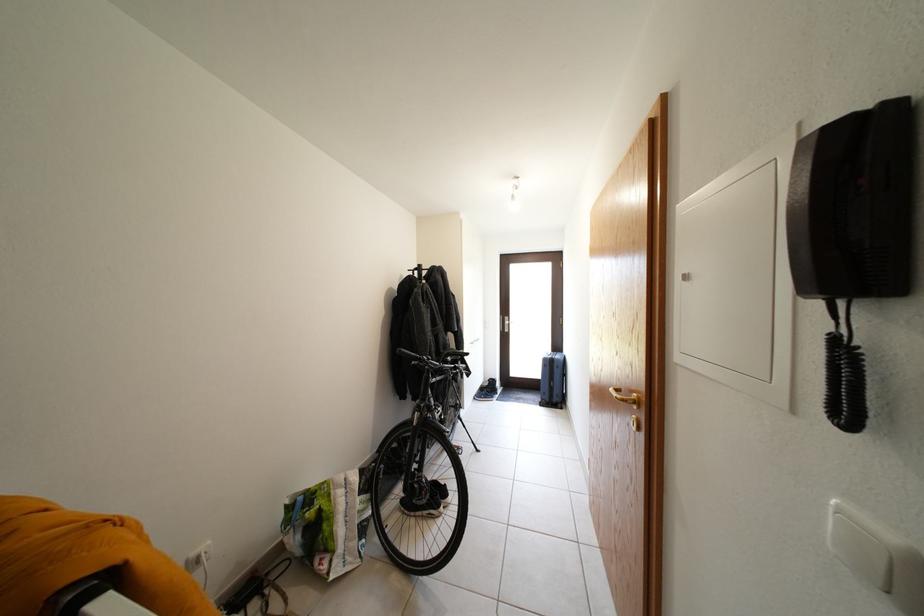
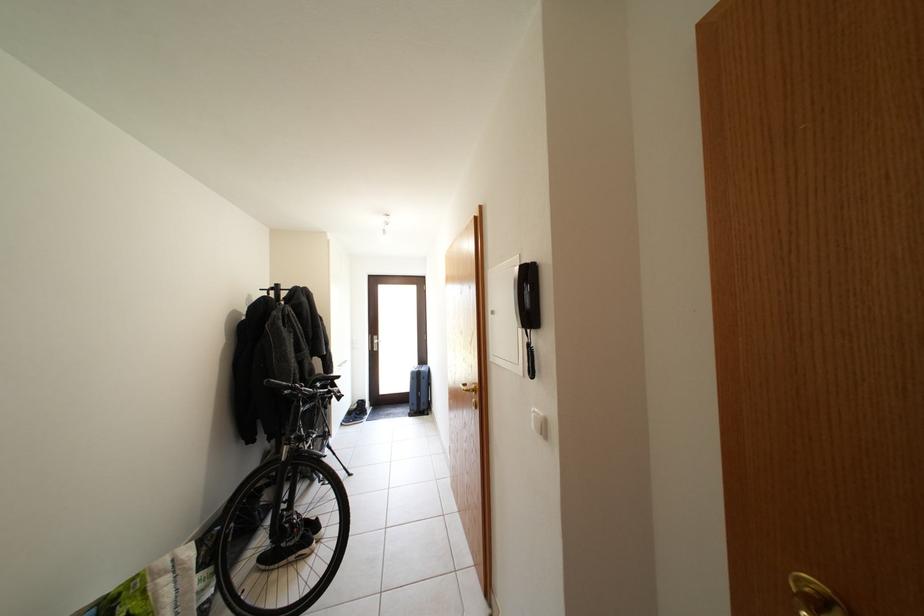
The point at (424, 275) is marked in the first image. Where is the corresponding point in the second image?

(281, 294)